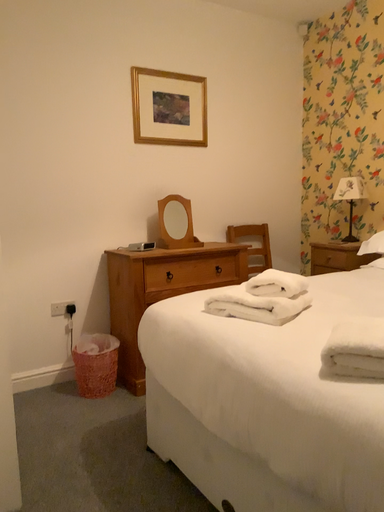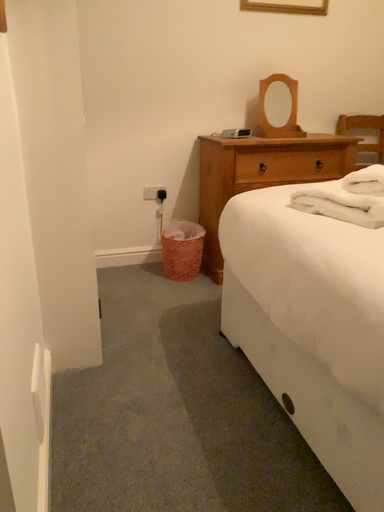
Question: Which way did the camera rotate in the video?

Choices:
 (A) rotated left
 (B) rotated right

Answer: (A)